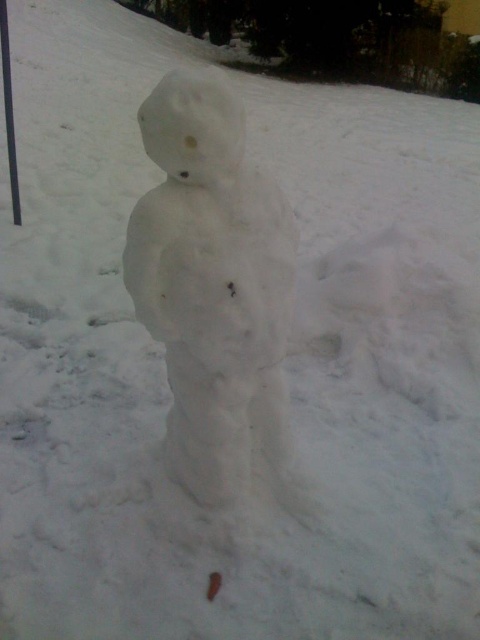
You are building a snowman and want to place the white fluffy snowman at center on top of the white snowman at center. Is this possible based on their positions?

The white fluffy snowman at center is positioned under the white snowman at center, so placing it on top would not be possible since it is already underneath.

You are standing in front of the snowman and want to place two markers at the locations of point (197, 355) and point (6, 97). Which marker will be closer to your position?

Point (197, 355) is closer to the viewer than point (6, 97), so the marker placed at point (197, 355) will be closer to your position.